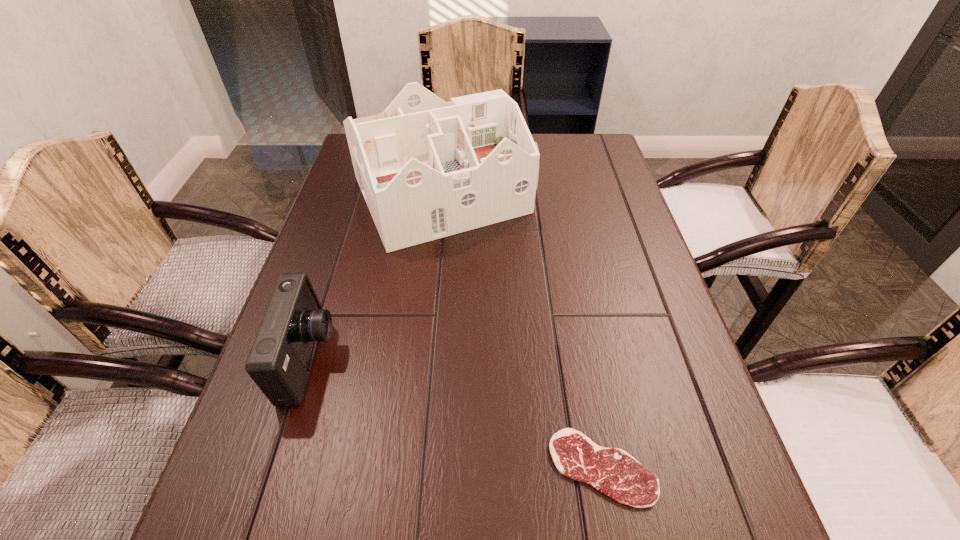
Image resolution: width=960 pixels, height=540 pixels. Identify the location of empty space that is in between the nearest object and the camera. (456, 413).

The height and width of the screenshot is (540, 960). What are the coordinates of `free area in between the second shortest object and the steak` in the screenshot? It's located at (456, 413).

At what (x,y) coordinates should I click in order to perform the action: click on vacant space that is in between the dollhouse and the camera. Please return your answer as a coordinate pair (x, y). This screenshot has width=960, height=540. Looking at the image, I should click on (376, 277).

The width and height of the screenshot is (960, 540). I want to click on free point between the farthest object and the nearest object, so click(x=522, y=331).

Identify the location of free space between the second nearest object and the dollhouse. (376, 277).

Locate an element on the screen. The height and width of the screenshot is (540, 960). free space between the shortest object and the camera is located at coordinates (456, 413).

The width and height of the screenshot is (960, 540). Find the location of `vacant region between the camera and the nearest object`. vacant region between the camera and the nearest object is located at coordinates (456, 413).

Find the location of `empty location between the dollhouse and the steak`. empty location between the dollhouse and the steak is located at coordinates (522, 331).

At what (x,y) coordinates should I click in order to perform the action: click on object identified as the closest to the camera. Please return your answer as a coordinate pair (x, y). Image resolution: width=960 pixels, height=540 pixels. Looking at the image, I should click on (428, 169).

Locate an element on the screen. object identified as the second closest to the second nearest object is located at coordinates (612, 471).